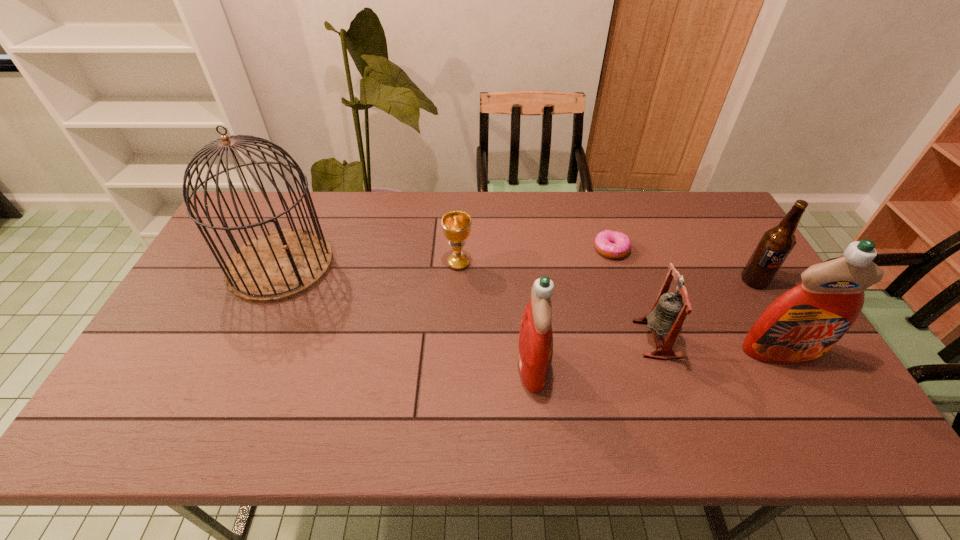
At what (x,y) coordinates should I click in order to perform the action: click on object at the left edge. Please return your answer as a coordinate pair (x, y). Looking at the image, I should click on (279, 265).

You are a GUI agent. You are given a task and a screenshot of the screen. Output one action in this format:
    pyautogui.click(x=<x>, y=<y>)
    Task: Click on the detergent that is at the right edge
    The width and height of the screenshot is (960, 540).
    Given the screenshot: What is the action you would take?
    pyautogui.click(x=801, y=325)

The image size is (960, 540). What are the coordinates of `beer bottle that is at the right edge` in the screenshot? It's located at point(776,244).

Identify the location of object present at the far left corner. (279, 265).

Image resolution: width=960 pixels, height=540 pixels. In the image, there is a desktop. What are the coordinates of `vacant space at the far edge` in the screenshot? It's located at (380, 231).

This screenshot has height=540, width=960. In the image, there is a desktop. Identify the location of free space at the near edge. (518, 380).

This screenshot has width=960, height=540. I want to click on vacant space at the left edge of the desktop, so click(200, 292).

Locate an element on the screen. This screenshot has width=960, height=540. blank area at the right edge is located at coordinates (709, 258).

The height and width of the screenshot is (540, 960). In the image, there is a desktop. In order to click on vacant space at the far left corner in this screenshot , I will do `click(235, 220)`.

This screenshot has height=540, width=960. Identify the location of vacant space at the far right corner of the desktop. (696, 229).